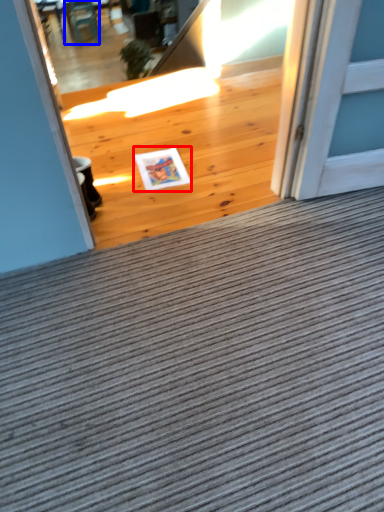
Question: Which of the following is the closest to the observer, postcard (highlighted by a red box) or chair (highlighted by a blue box)?

Choices:
 (A) postcard
 (B) chair

Answer: (A)